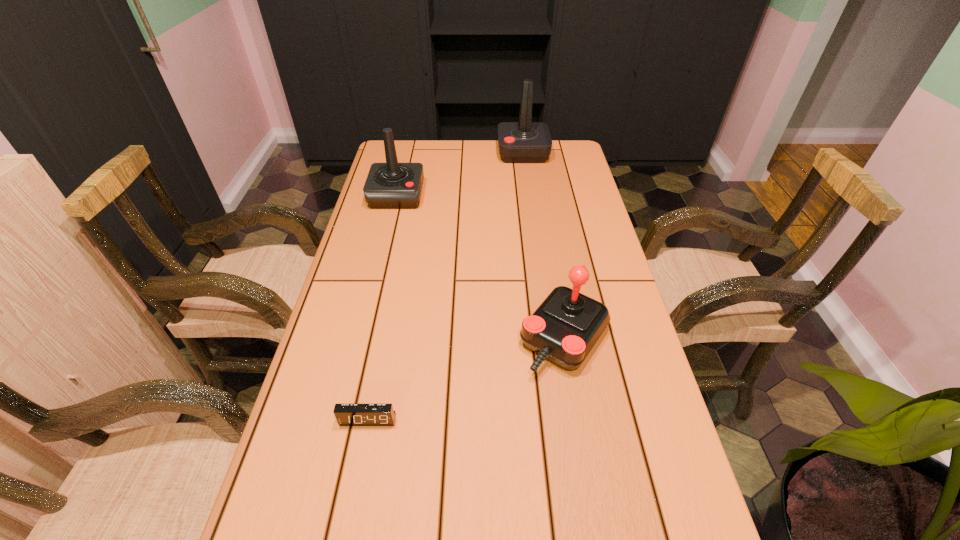
Find the location of a particular element. This screenshot has width=960, height=540. free area in between the shortest object and the third nearest object is located at coordinates (382, 308).

Where is `vacant space that is in between the leftmost joystick and the shortest object`? vacant space that is in between the leftmost joystick and the shortest object is located at coordinates (382, 308).

This screenshot has height=540, width=960. I want to click on empty space between the nearest object and the nearest joystick, so click(466, 379).

Where is `free space between the nearest joystick and the farthest joystick`? The width and height of the screenshot is (960, 540). free space between the nearest joystick and the farthest joystick is located at coordinates (543, 246).

At what (x,y) coordinates should I click in order to perform the action: click on empty location between the farthest object and the second nearest joystick. Please return your answer as a coordinate pair (x, y). The width and height of the screenshot is (960, 540). Looking at the image, I should click on (460, 174).

Where is `vacant space that is in between the alarm clock and the farthest joystick`? Image resolution: width=960 pixels, height=540 pixels. vacant space that is in between the alarm clock and the farthest joystick is located at coordinates (445, 286).

I want to click on vacant space that is in between the alarm clock and the farthest joystick, so click(445, 286).

In order to click on vacant point located between the nearest joystick and the alarm clock in this screenshot , I will do `click(466, 379)`.

Select which object is the second closest to the farthest object. Please provide its 2D coordinates. Your answer should be formatted as a tuple, i.e. [(x, y)], where the tuple contains the x and y coordinates of a point satisfying the conditions above.

[(564, 328)]

At what (x,y) coordinates should I click in order to perform the action: click on the closest object to the farthest object. Please return your answer as a coordinate pair (x, y). Looking at the image, I should click on (391, 185).